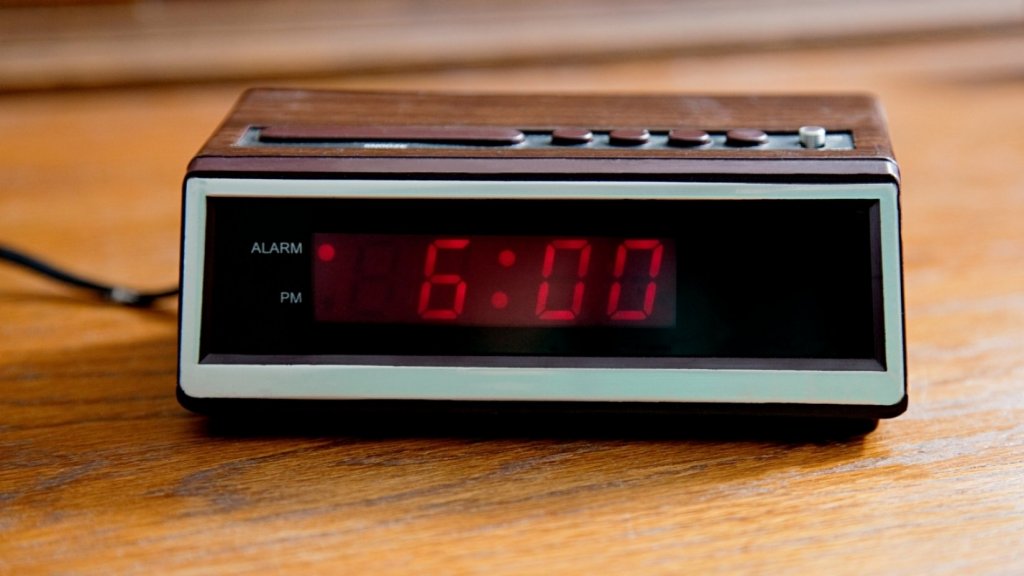
Find the location of a particular element. The height and width of the screenshot is (576, 1024). elongated oval brown button on top of clock to the far left is located at coordinates (359, 131).